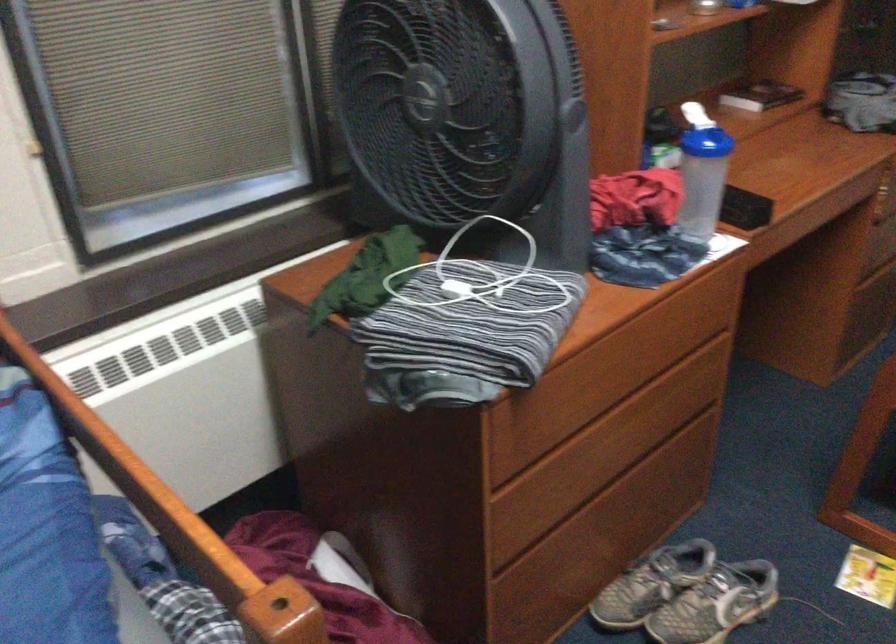
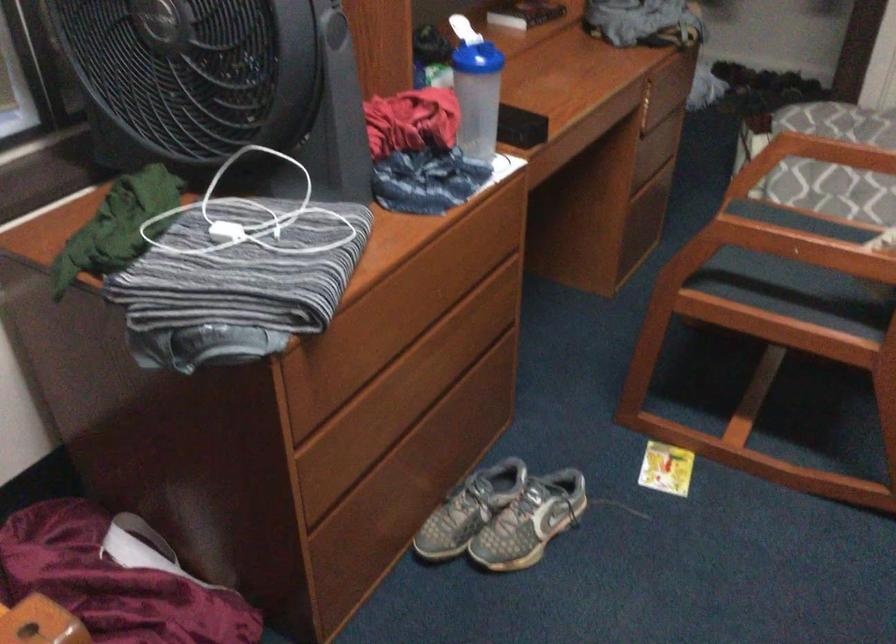
Locate, in the second image, the point that corresponds to (476,277) in the first image.

(250, 216)